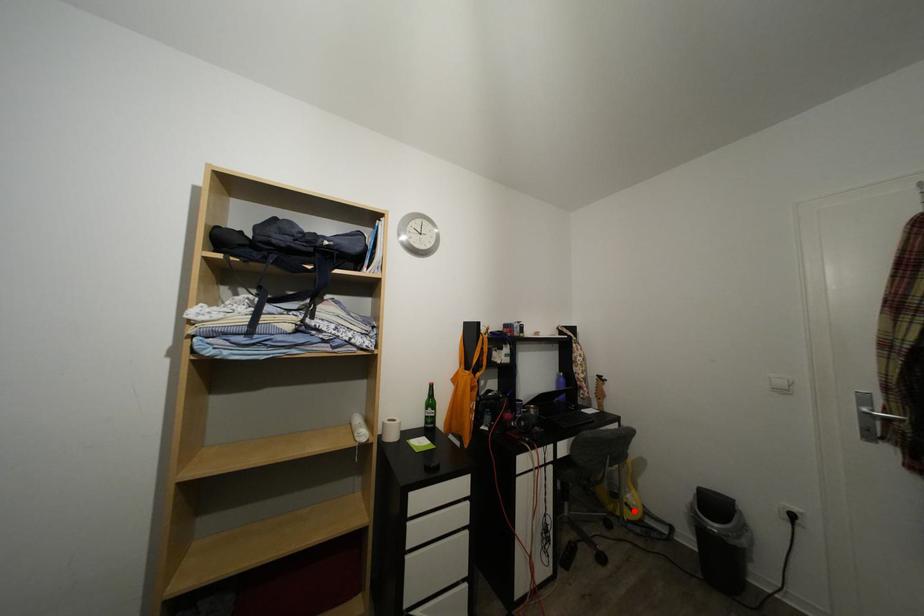
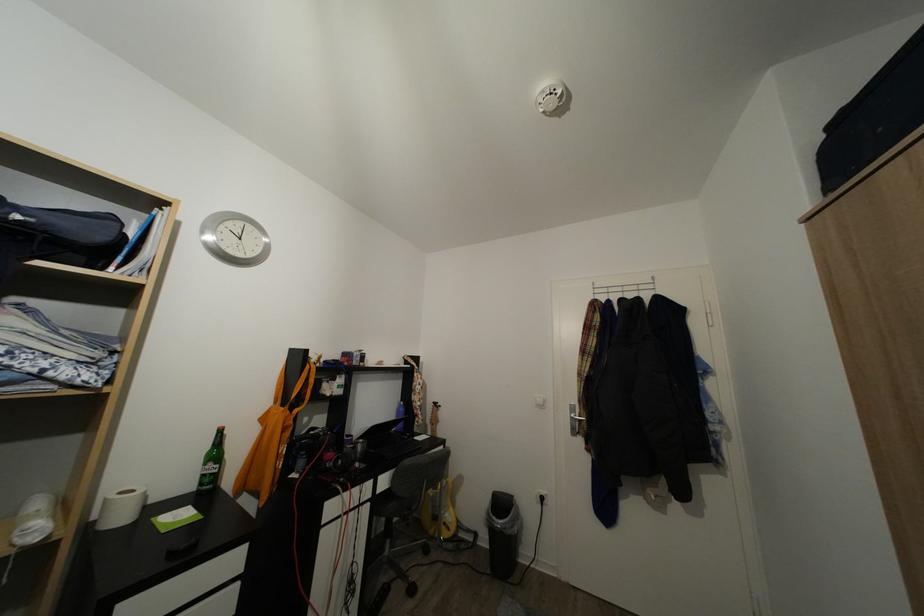
Where in the second image is the point corresponding to the highlighted location from the first image?

(453, 531)